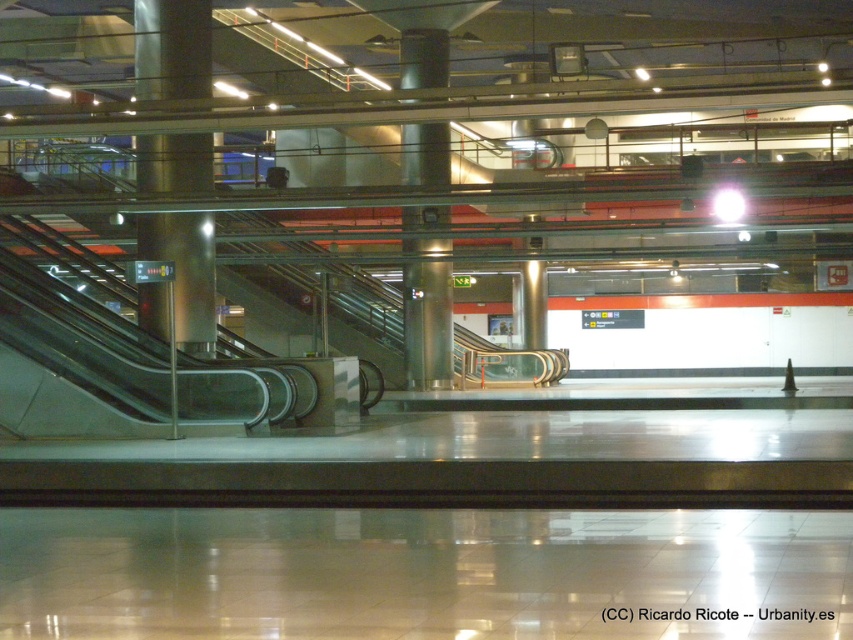
Does satin silver pillar at center have a greater height compared to satin silver column at center?

In fact, satin silver pillar at center may be shorter than satin silver column at center.

Measure the distance between point (158,42) and camera.

Point (158,42) is 66.07 feet away from camera.

Which is in front, point (193, 285) or point (402, 67)?

Positioned in front is point (193, 285).

Locate an element on the screen. satin silver pillar at center is located at coordinates (172, 49).